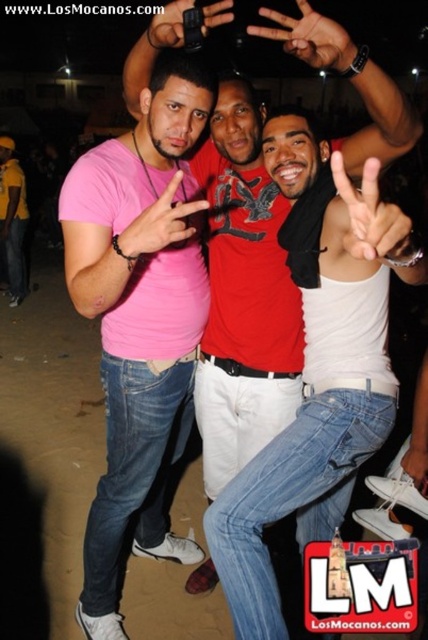
You are a photographer trying to capture the perfect shot of the black matte hand at upper center and the pink matte shirt at center. Based on their positions, which object is higher in the frame?

The black matte hand at upper center is higher in the frame than the pink matte shirt at center.